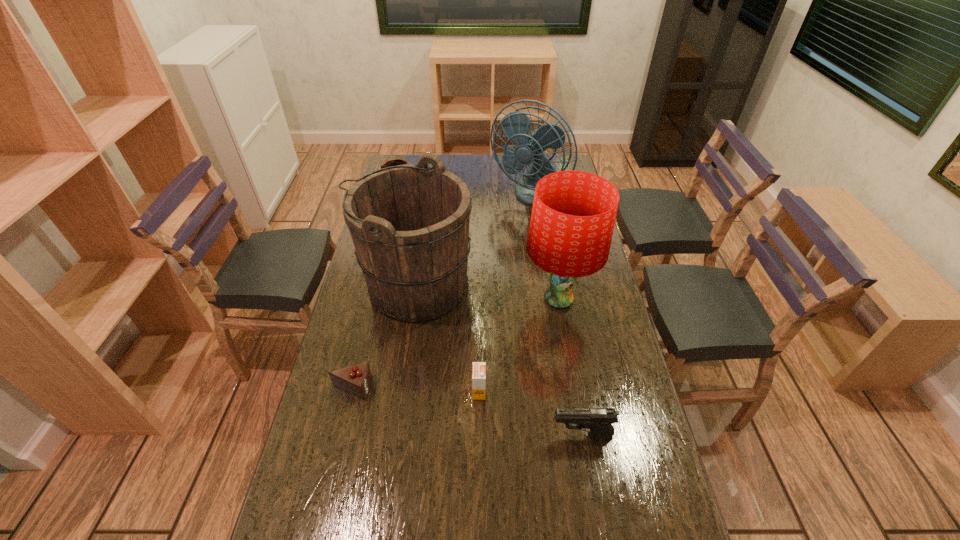
At what (x,y) coordinates should I click in order to perform the action: click on pottery at the left edge. Please return your answer as a coordinate pair (x, y). The width and height of the screenshot is (960, 540). Looking at the image, I should click on (394, 162).

Locate an element on the screen. chocolate cake that is at the left edge is located at coordinates (356, 379).

Identify the location of fan at the right edge. (515, 125).

Identify the location of lampshade located at the right edge. The image size is (960, 540). [573, 215].

You are a GUI agent. You are given a task and a screenshot of the screen. Output one action in this format:
    pyautogui.click(x=<x>, y=<y>)
    Task: Click on the pistol positioned at the right edge
    The width and height of the screenshot is (960, 540).
    Given the screenshot: What is the action you would take?
    pyautogui.click(x=599, y=420)

What are the coordinates of `object that is at the far right corner` in the screenshot? It's located at (515, 125).

In order to click on vacant area at the left edge of the desktop in this screenshot , I will do point(350,320).

At what (x,y) coordinates should I click in order to perform the action: click on vacant position at the right edge of the desktop. Please return your answer as a coordinate pair (x, y). The height and width of the screenshot is (540, 960). Looking at the image, I should click on (593, 359).

The image size is (960, 540). I want to click on free point between the pistol and the bucket, so (x=499, y=360).

Identify the location of vacant space in between the nearest object and the shortest object. Image resolution: width=960 pixels, height=540 pixels. (468, 411).